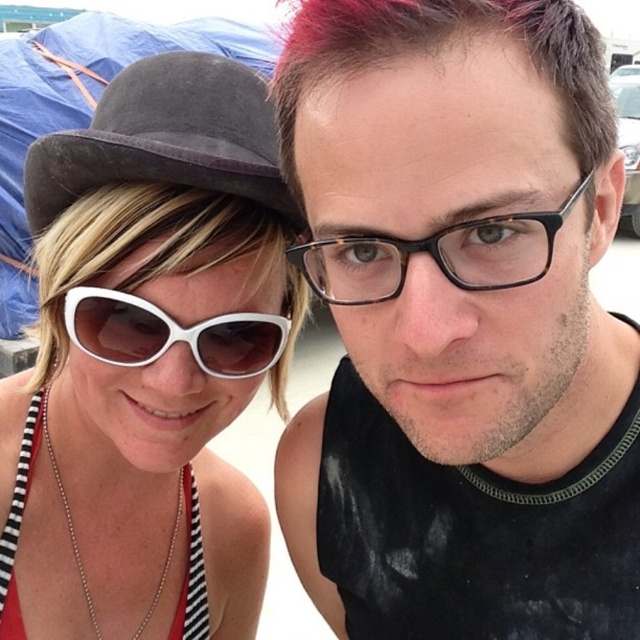
You are taking a photo of the two people in the scene. The suede fedora at upper left and the blondehair at left are both in the frame. Which object is positioned closer to the camera?

The suede fedora at upper left is closer to the viewer than the blondehair at left, so the suede fedora at upper left is positioned closer to the camera.

You are taking a selfie with two people. You want to ensure that the point at coordinates point (86, 170) is in focus. What is the minimum distance you should set your camera to focus at?

The distance of point (86, 170) from the camera is 31.70 inches, so you should set the camera focus to at least 31.70 inches to ensure that point is in focus.